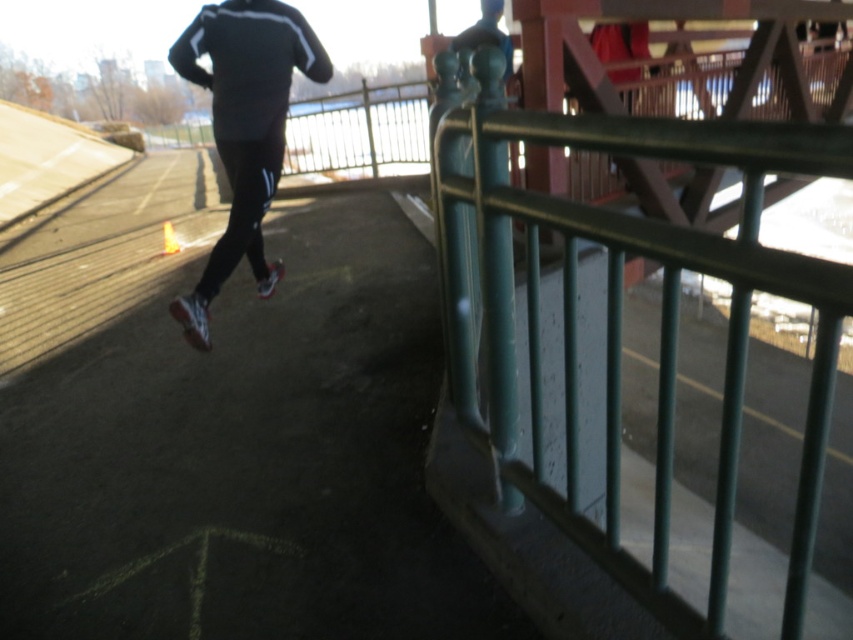
You are standing at the point where the runner is currently positioned. You want to throw a small ball to a friend who is standing 1.5 meters away from you. Is the point at coordinates point (653, 588) within the area where you can reach by throwing the ball?

The distance of point (653, 588) from viewer is 1.20 meters, so yes, the point is within the 1.5 meters reach of the thrown ball.

You are a photographer standing at the edge of a bridge. You want to take a photo of the green painted metal railing at center so that it is in focus. Your camera has a minimum focusing distance of 28 inches. Will you need to move closer or farther away to ensure the railing is in focus?

The green painted metal railing at center is 27.64 inches away from the viewer. Since the minimum focusing distance is 28 inches, you need to move slightly farther away to ensure the railing is in focus.